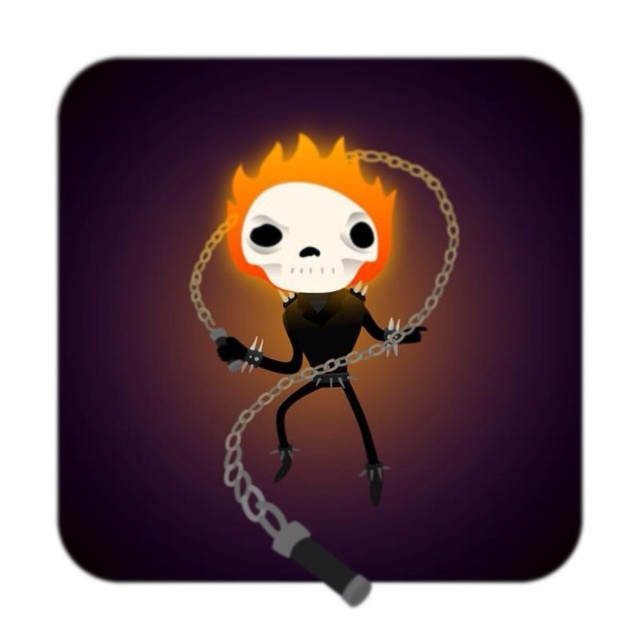
You are a photographer trying to capture the skeleton character in the image. You notice two points marked in the scene. Which point, point 1 at coordinates (x=195, y=579) or point 2 at (x=216, y=332), is closer to your camera lens?

Point 1 at coordinates (x=195, y=579) is closer to the camera lens than point 2 at (x=216, y=332).

Based on the scene description, which object is positioned closer to the viewer between the translucent white skull at center and the metallic chain at center?

The translucent white skull at center is closer to the viewer because the metallic chain at center is positioned behind it.